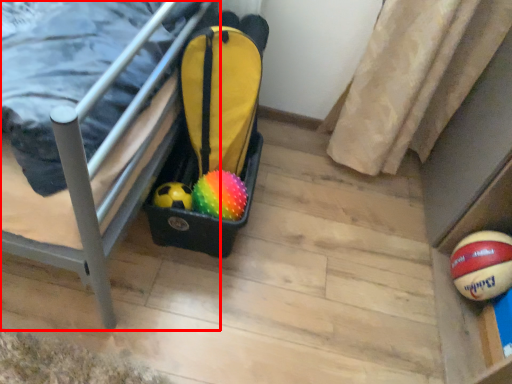
Question: From the image's perspective, what is the correct spatial positioning of furniture (annotated by the red box) in reference to ball?

Choices:
 (A) below
 (B) above

Answer: (B)